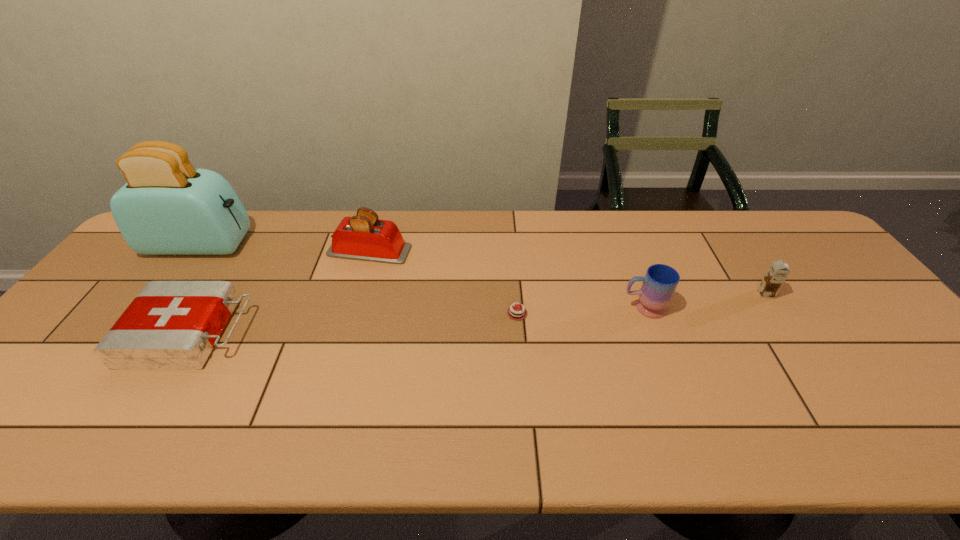
Identify the location of vacant space that satisfies the following two spatial constraints: 1. on the side of the taller toaster with the lever; 2. on the right side of the rightmost object. The height and width of the screenshot is (540, 960). (163, 294).